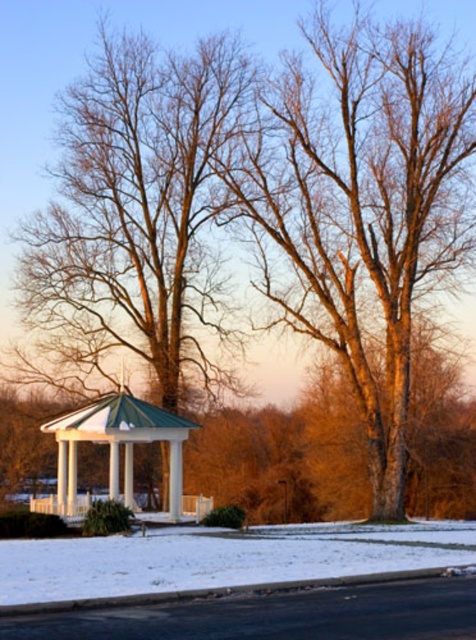
Who is lower down, brown wood tree at center or white powdery snow at lower center?

white powdery snow at lower center is lower down.

Image resolution: width=476 pixels, height=640 pixels. What do you see at coordinates (136, 216) in the screenshot? I see `brown wood tree at center` at bounding box center [136, 216].

What do you see at coordinates (136, 216) in the screenshot? I see `brown wood tree at center` at bounding box center [136, 216].

At what (x,y) coordinates should I click in order to perform the action: click on brown wood tree at center. Please return your answer as a coordinate pair (x, y). Image resolution: width=476 pixels, height=640 pixels. Looking at the image, I should click on (136, 216).

Which of these two, bare wood tree at center or brown wood tree at center, stands taller?

bare wood tree at center

Does point (297, 205) come closer to viewer compared to point (71, 218)?

Yes, point (297, 205) is closer to viewer.

This screenshot has height=640, width=476. Identify the location of bare wood tree at center. (363, 204).

Which is behind, point (119, 592) or point (77, 506)?

Positioned behind is point (77, 506).

Between white powdery snow at lower center and white glossy gazebo at center, which one has more height?

With more height is white glossy gazebo at center.

Does point (308, 529) come farther from viewer compared to point (156, 419)?

No, (308, 529) is in front of (156, 419).

Locate an element on the screen. The width and height of the screenshot is (476, 640). white powdery snow at lower center is located at coordinates (222, 557).